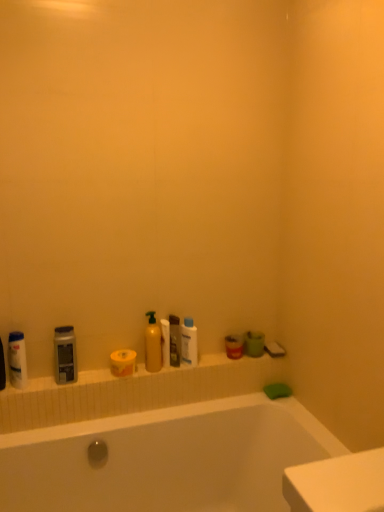
Question: Does matte gray bottle at left, which is counted as the first cleaning product, starting from the left, contain white matte toilet paper at center, which is the 1th toilet paper from right to left?

Choices:
 (A) yes
 (B) no

Answer: (B)

Question: Can you confirm if matte gray bottle at left, which is counted as the first cleaning product, starting from the left, is positioned to the left of white matte toilet paper at center, the 2th toilet paper when ordered from left to right?

Choices:
 (A) yes
 (B) no

Answer: (A)

Question: Is matte gray bottle at left, which is counted as the first cleaning product, starting from the left, positioned in front of white matte toilet paper at center, the 2th toilet paper when ordered from left to right?

Choices:
 (A) yes
 (B) no

Answer: (A)

Question: From the image's perspective, is matte gray bottle at left, which is counted as the first cleaning product, starting from the left, on white matte toilet paper at center, the 2th toilet paper when ordered from left to right?

Choices:
 (A) yes
 (B) no

Answer: (B)

Question: Is matte gray bottle at left, which ranks as the third cleaning product in right-to-left order, wider than white matte toilet paper at center, the 2th toilet paper when ordered from left to right?

Choices:
 (A) yes
 (B) no

Answer: (A)

Question: From the image's perspective, is yellow matte toilet paper at center, marked as the second toilet paper in a right-to-left arrangement, above or below matte yellow bottle at center, the second cleaning product from the right?

Choices:
 (A) below
 (B) above

Answer: (A)

Question: Is yellow matte toilet paper at center, acting as the 1th toilet paper starting from the left, inside the boundaries of matte yellow bottle at center, which is counted as the 2th cleaning product, starting from the left, or outside?

Choices:
 (A) outside
 (B) inside

Answer: (A)

Question: Does point tap(127, 371) appear closer or farther from the camera than point tap(157, 325)?

Choices:
 (A) farther
 (B) closer

Answer: (A)

Question: Would you say yellow matte toilet paper at center, marked as the second toilet paper in a right-to-left arrangement, is to the left or to the right of matte yellow bottle at center, the second cleaning product from the right, in the picture?

Choices:
 (A) left
 (B) right

Answer: (A)

Question: From the image's perspective, relative to white matte toilet paper at center, the 2th toilet paper when ordered from left to right, is matte plastic mouthwash at center, the 2th mouthwash when ordered from left to right, above or below?

Choices:
 (A) above
 (B) below

Answer: (B)

Question: Based on their sizes in the image, would you say matte plastic mouthwash at center, the 1th mouthwash viewed from the back, is bigger or smaller than white matte toilet paper at center, which is the 1th toilet paper from right to left?

Choices:
 (A) small
 (B) big

Answer: (B)

Question: From a real-world perspective, is matte plastic mouthwash at center, the 1th mouthwash viewed from the back, positioned above or below white matte toilet paper at center, which is the 1th toilet paper from right to left?

Choices:
 (A) below
 (B) above

Answer: (A)

Question: Looking at their shapes, would you say matte plastic mouthwash at center, which is the 2th mouthwash from front to back, is wider or thinner than white matte toilet paper at center, which is the 1th toilet paper from right to left?

Choices:
 (A) thin
 (B) wide

Answer: (B)

Question: Is translucent plastic bottle at center, which ranks as the 3th cleaning product in left-to-right order, inside the boundaries of yellow matte toilet paper at center, marked as the second toilet paper in a right-to-left arrangement, or outside?

Choices:
 (A) inside
 (B) outside

Answer: (B)

Question: From a real-world perspective, is translucent plastic bottle at center, arranged as the 1th cleaning product when viewed from the right, above or below yellow matte toilet paper at center, marked as the second toilet paper in a right-to-left arrangement?

Choices:
 (A) below
 (B) above

Answer: (B)